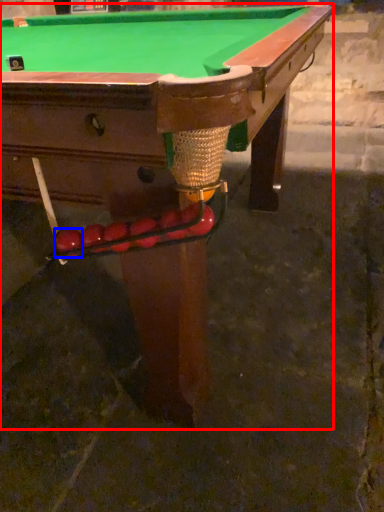
Question: Which object appears closest to the camera in this image, billiard table (highlighted by a red box) or fruit (highlighted by a blue box)?

Choices:
 (A) billiard table
 (B) fruit

Answer: (A)